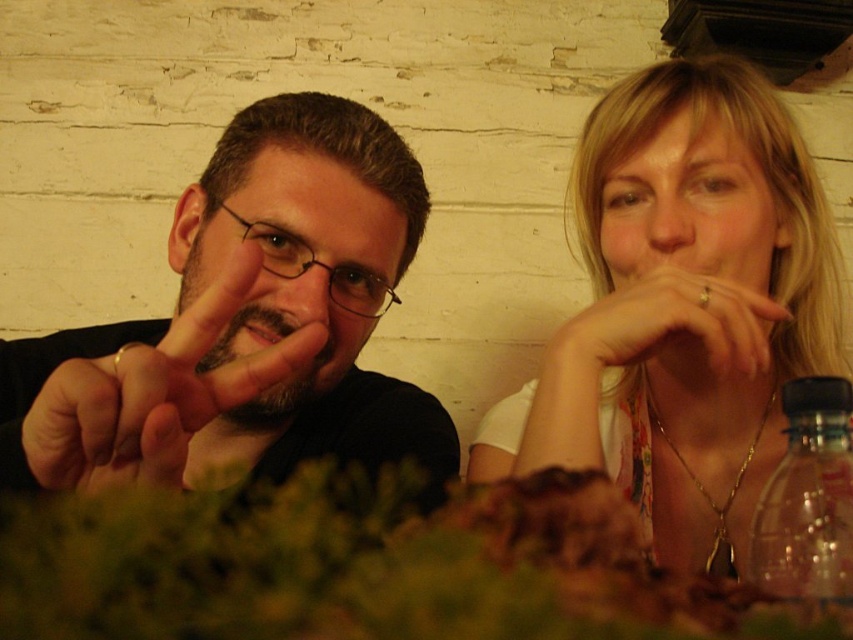
Question: Does black matte hand at left lie behind gold ring at upper right?

Choices:
 (A) yes
 (B) no

Answer: (B)

Question: Among these points, which one is nearest to the camera?

Choices:
 (A) (741, 257)
 (B) (717, 298)

Answer: (B)

Question: Is blonde hair at upper right smaller than gold ring at upper right?

Choices:
 (A) yes
 (B) no

Answer: (B)

Question: Among these points, which one is farthest from the camera?

Choices:
 (A) [x=724, y=356]
 (B) [x=97, y=474]
 (C) [x=105, y=404]
 (D) [x=581, y=410]

Answer: (D)

Question: Is black matte hand at left to the right of clear plastic bottle at right from the viewer's perspective?

Choices:
 (A) no
 (B) yes

Answer: (A)

Question: Considering the real-world distances, which object is closest to the black matte hand at left?

Choices:
 (A) blonde hair at upper right
 (B) matte black shirt at left
 (C) clear plastic bottle at right
 (D) gold ring at upper right

Answer: (B)